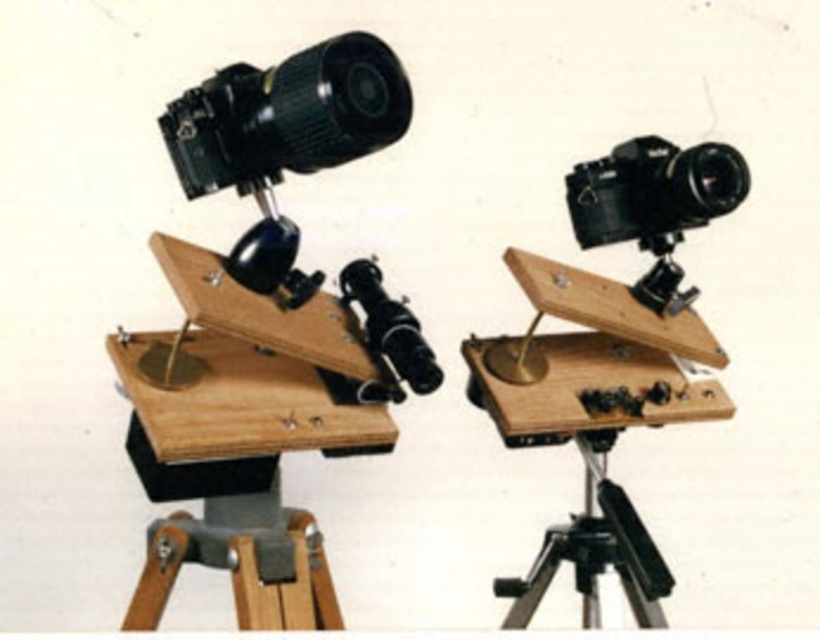
Question: From the image, what is the correct spatial relationship of black plastic camera at upper left in relation to black matte camera at center?

Choices:
 (A) right
 (B) left

Answer: (B)

Question: Does black plastic camera at upper left have a larger size compared to black metal tripod at lower right?

Choices:
 (A) no
 (B) yes

Answer: (A)

Question: Which is nearer to the black plastic camera at upper left?

Choices:
 (A) black metal tripod at lower right
 (B) black matte camera at center

Answer: (B)

Question: Among these objects, which one is farthest from the camera?

Choices:
 (A) black plastic camera at upper left
 (B) black metal tripod at lower right
 (C) black matte camera at center

Answer: (C)

Question: Does black plastic camera at upper left appear on the left side of black matte camera at center?

Choices:
 (A) no
 (B) yes

Answer: (B)

Question: Considering the real-world distances, which object is closest to the black matte camera at center?

Choices:
 (A) black plastic camera at upper left
 (B) black metal tripod at lower right

Answer: (B)